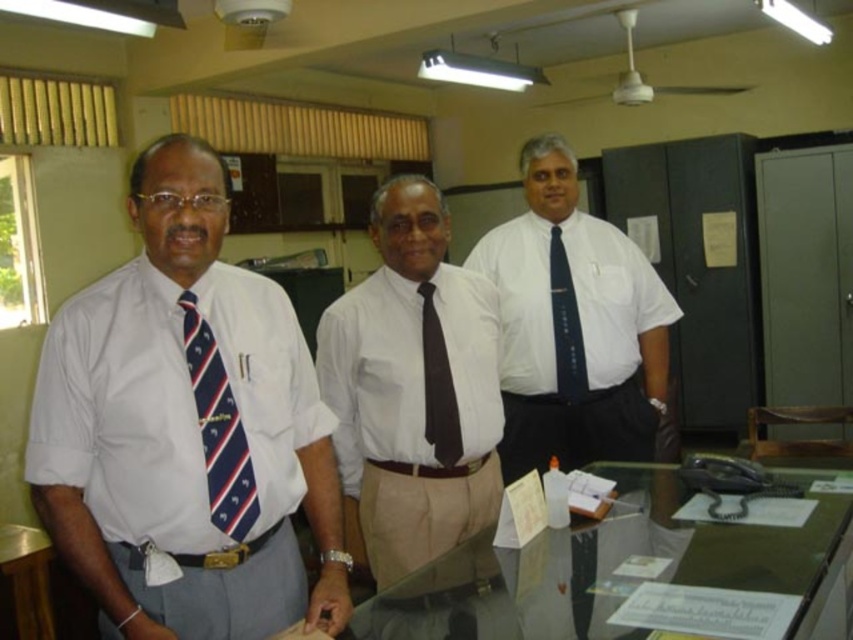
You are organizing a formal event and need to ensure that all attire meets specific size requirements. You have the white smooth shirt at center and the black silk tie at center. Which item is bigger in size?

The white smooth shirt at center is larger in size than the black silk tie at center.

You are standing in an office and need to reach a point marked at coordinates (590, 417). The desk in front of you is cluttered. Can you walk directly to that point without moving any items on the desk?

The point at coordinates (590, 417) is 2.65 meters away from the camera. Since the desk is cluttered, it might block your path, so you should check if there is enough space to navigate around the cluttered items on the desk to reach the point.

There are three men standing in an office. The first man is at point (438, 404). How far apart are they?

The three men are 1.94 meters apart.